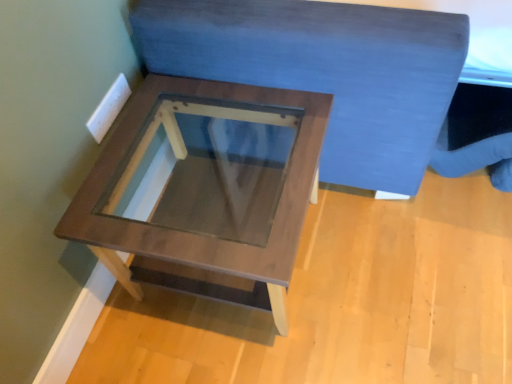
Identify the location of vacant space in front of wooden table at center. (254, 352).